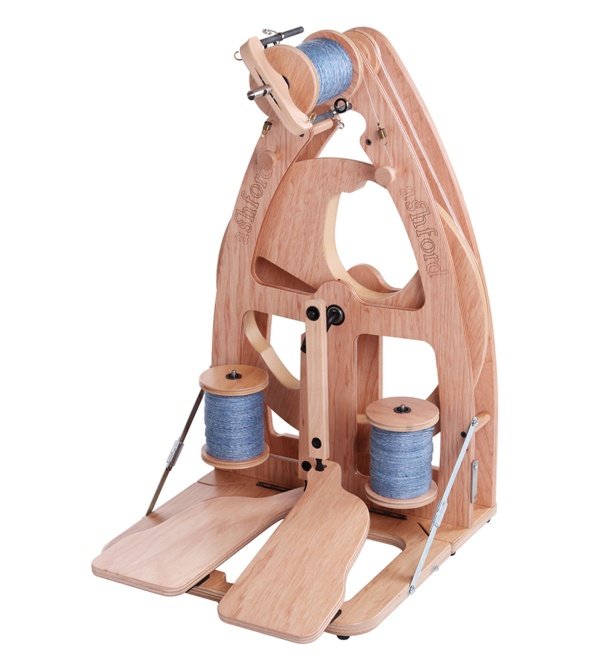
What are the coordinates of `metal hinge` in the screenshot? It's located at coord(437,517), coord(173,449).